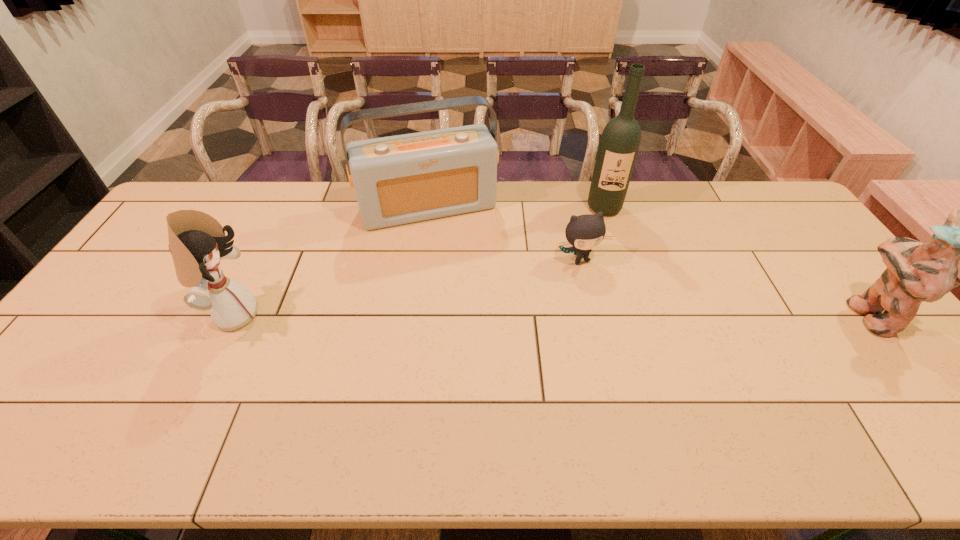
Where is `wine bottle that is at the far edge`? The height and width of the screenshot is (540, 960). wine bottle that is at the far edge is located at coordinates (620, 140).

You are a GUI agent. You are given a task and a screenshot of the screen. Output one action in this format:
    pyautogui.click(x=<x>, y=<y>)
    Task: Click on the object positioned at the right edge
    The image size is (960, 540).
    Given the screenshot: What is the action you would take?
    click(916, 272)

Find the location of a particular element. Image resolution: width=960 pixels, height=540 pixels. vacant space at the far edge is located at coordinates (532, 200).

Where is `vacant space at the near edge`? vacant space at the near edge is located at coordinates (667, 400).

You are a GUI agent. You are given a task and a screenshot of the screen. Output one action in this format:
    pyautogui.click(x=<x>, y=<y>)
    Task: Click on the vacant space at the left edge
    The height and width of the screenshot is (540, 960).
    Given the screenshot: What is the action you would take?
    pyautogui.click(x=88, y=316)

Image resolution: width=960 pixels, height=540 pixels. Find the location of `free point at the right edge`. free point at the right edge is located at coordinates (875, 343).

Find the location of a particular element. free space at the far right corner of the desktop is located at coordinates (762, 197).

Locate an element on the screen. free space at the near right corner is located at coordinates (868, 386).

The image size is (960, 540). I want to click on vacant area that lies between the second object from left to right and the doll, so click(x=331, y=261).

At what (x,y) coordinates should I click in order to perform the action: click on free spot between the fourth object from right to left and the doll. Please return your answer as a coordinate pair (x, y). The height and width of the screenshot is (540, 960). Looking at the image, I should click on (331, 261).